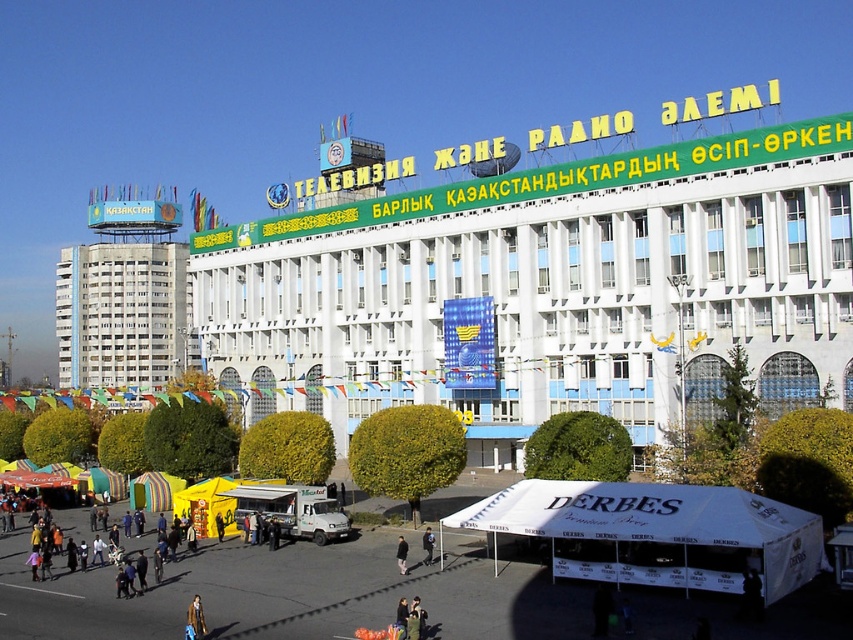
Is yellow fabric canopy at lower left below dark brown leather jacket at lower center?

Incorrect, yellow fabric canopy at lower left is not positioned below dark brown leather jacket at lower center.

Locate an element on the screen. yellow fabric canopy at lower left is located at coordinates (206, 506).

Which is more to the right, white concrete building at left or black fabric person at center?

From the viewer's perspective, black fabric person at center appears more on the right side.

Is white concrete building at left bigger than black fabric person at center?

Indeed, white concrete building at left has a larger size compared to black fabric person at center.

Is point (102, 304) more distant than point (399, 547)?

Yes, point (102, 304) is behind point (399, 547).

Image resolution: width=853 pixels, height=640 pixels. What are the coordinates of `white concrete building at left` in the screenshot? It's located at (123, 314).

The height and width of the screenshot is (640, 853). Identify the location of white fabric canopy at lower center. (656, 532).

Is point (808, 557) positioned behind point (415, 618)?

Yes, it is behind point (415, 618).

Where is `white fabric canopy at lower center`? The image size is (853, 640). white fabric canopy at lower center is located at coordinates (656, 532).